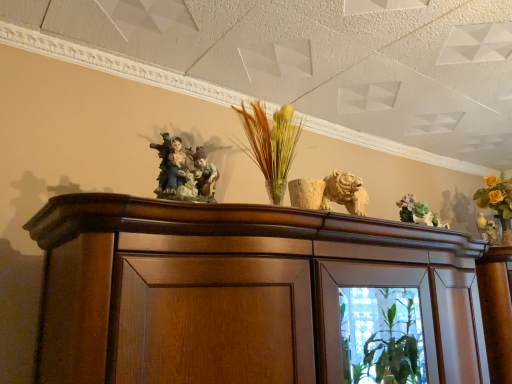
Question: Can you confirm if green ceramic vase at upper right is positioned to the left of matte porcelain figurine at center?

Choices:
 (A) no
 (B) yes

Answer: (A)

Question: Could you tell me if green ceramic vase at upper right is turned towards matte porcelain figurine at center?

Choices:
 (A) yes
 (B) no

Answer: (B)

Question: From the image's perspective, is green ceramic vase at upper right beneath matte porcelain figurine at center?

Choices:
 (A) no
 (B) yes

Answer: (B)

Question: Can you confirm if green ceramic vase at upper right is thinner than matte porcelain figurine at center?

Choices:
 (A) no
 (B) yes

Answer: (B)

Question: Is green ceramic vase at upper right oriented away from matte porcelain figurine at center?

Choices:
 (A) yes
 (B) no

Answer: (B)

Question: Can you confirm if green ceramic vase at upper right is wider than matte porcelain figurine at center?

Choices:
 (A) yes
 (B) no

Answer: (B)

Question: Can you confirm if matte porcelain figurine at center is taller than green ceramic vase at upper right?

Choices:
 (A) no
 (B) yes

Answer: (B)

Question: Would you say matte porcelain figurine at center contains green ceramic vase at upper right?

Choices:
 (A) no
 (B) yes

Answer: (A)

Question: From a real-world perspective, does matte porcelain figurine at center sit lower than green ceramic vase at upper right?

Choices:
 (A) no
 (B) yes

Answer: (A)

Question: Is the depth of matte porcelain figurine at center less than that of green ceramic vase at upper right?

Choices:
 (A) no
 (B) yes

Answer: (B)

Question: Is matte porcelain figurine at center aimed at green ceramic vase at upper right?

Choices:
 (A) no
 (B) yes

Answer: (A)

Question: Does matte porcelain figurine at center have a lesser width compared to green ceramic vase at upper right?

Choices:
 (A) no
 (B) yes

Answer: (A)

Question: Considering the positions of matte porcelain figurine at center and green ceramic vase at upper right in the image, is matte porcelain figurine at center wider or thinner than green ceramic vase at upper right?

Choices:
 (A) wide
 (B) thin

Answer: (A)